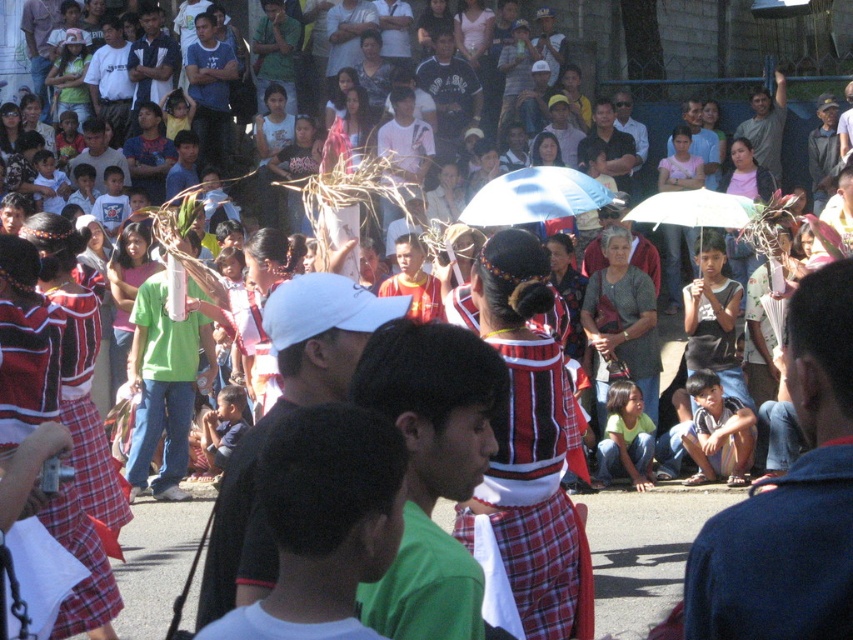
Question: Which of these objects is positioned farthest from the dark blue jersey at center?

Choices:
 (A) blue denim shirt at center
 (B) denim jacket at lower right
 (C) blue fabric umbrella at center

Answer: (B)

Question: Considering the relative positions of white cap at center and blue fabric umbrella at center in the image provided, where is white cap at center located with respect to blue fabric umbrella at center?

Choices:
 (A) above
 (B) below

Answer: (B)

Question: Is blue denim shirt at center bigger than matte white cap at center?

Choices:
 (A) no
 (B) yes

Answer: (B)

Question: Does denim jacket at lower right lie behind dark blue jersey at center?

Choices:
 (A) yes
 (B) no

Answer: (B)

Question: Estimate the real-world distances between objects in this image. Which object is farther from the dark blue jersey at center?

Choices:
 (A) matte white cap at center
 (B) white cap at center

Answer: (B)

Question: Estimate the real-world distances between objects in this image. Which object is farther from the green fabric shirt at center?

Choices:
 (A) dark blue jersey at center
 (B) white matte umbrella at center
 (C) matte white cap at center

Answer: (A)